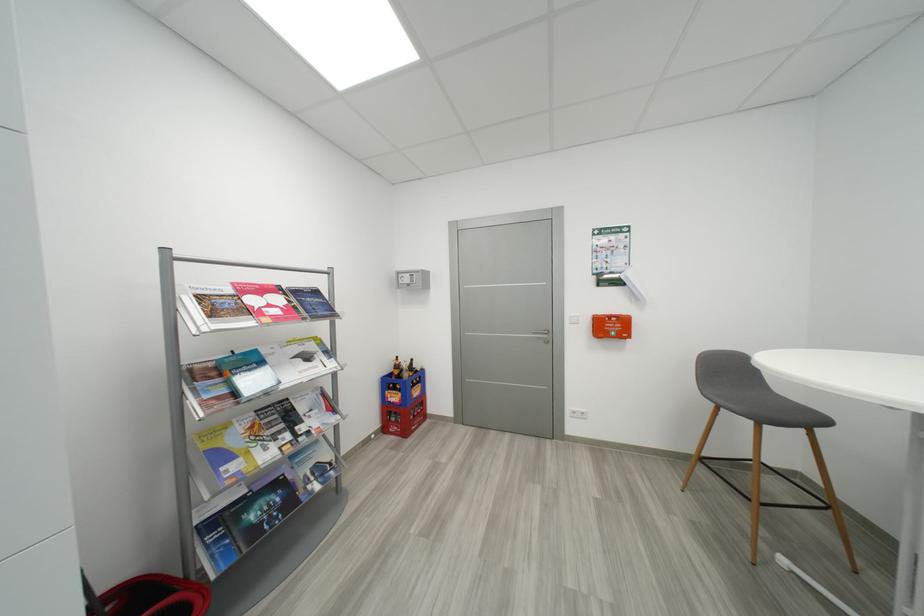
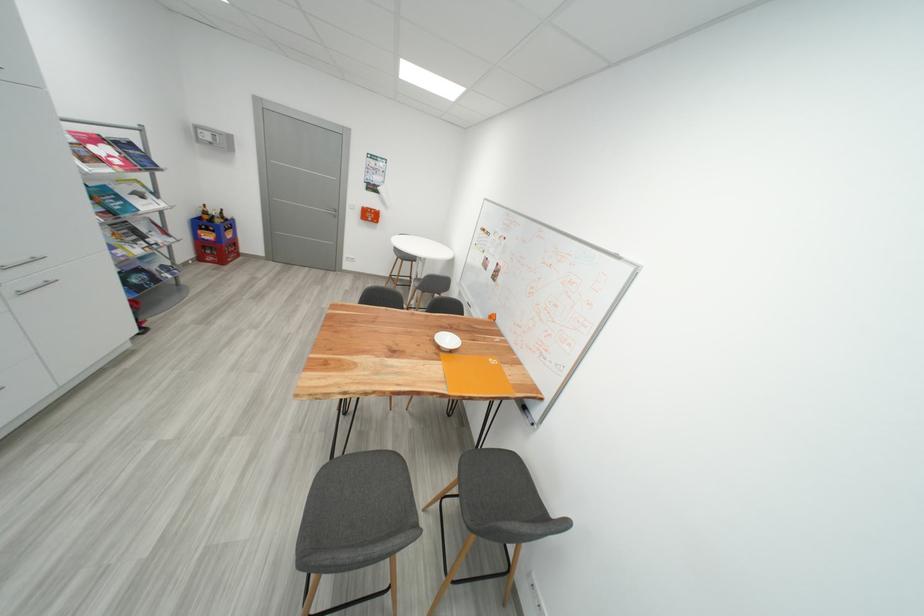
The point at (252, 312) is marked in the first image. Where is the corresponding point in the second image?

(104, 161)